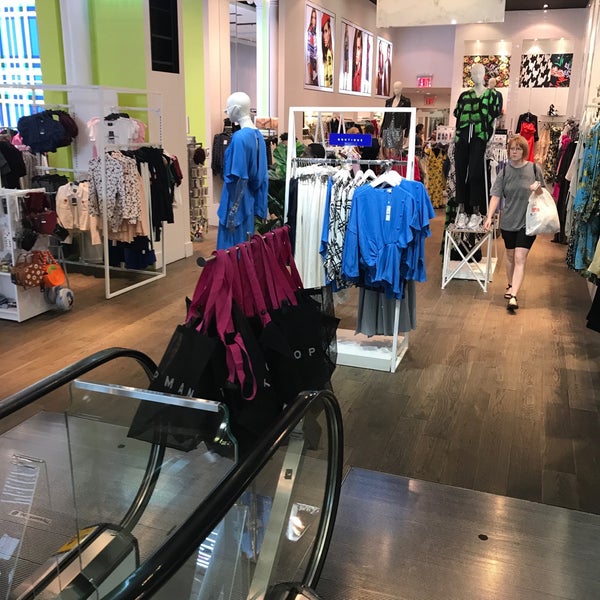
Locate an element on the screen. rivet in floor is located at coordinates (481, 545).